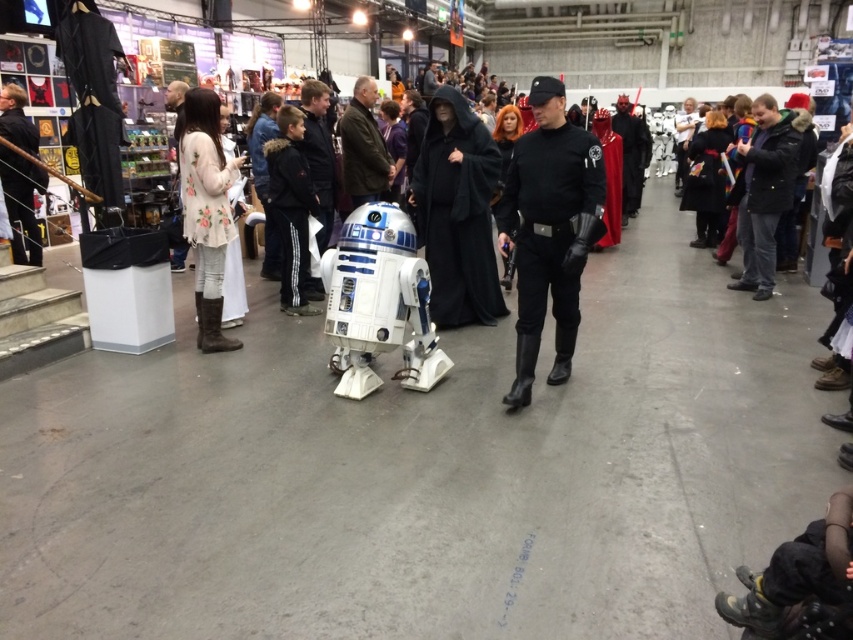
Can you confirm if floral-patterned fabric at center is bigger than black leather mask at upper right?

Incorrect, floral-patterned fabric at center is not larger than black leather mask at upper right.

Is point (196, 99) farther from camera compared to point (619, 104)?

No, it is not.

The image size is (853, 640). In order to click on floral-patterned fabric at center in this screenshot , I will do `click(206, 211)`.

Which of these two, floral-patterned fabric at center or floral-patterned dress at center, stands taller?

floral-patterned fabric at center is taller.

Between floral-patterned fabric at center and floral-patterned dress at center, which one has less height?

floral-patterned dress at center is shorter.

The image size is (853, 640). I want to click on floral-patterned fabric at center, so 206,211.

Looking at this image, is dark brown leather jacket at center thinner than floral-patterned dress at center?

Indeed, dark brown leather jacket at center has a lesser width compared to floral-patterned dress at center.

Which is behind, point (393, 164) or point (169, 97)?

Positioned behind is point (393, 164).

Locate an element on the screen. The height and width of the screenshot is (640, 853). dark brown leather jacket at center is located at coordinates (364, 147).